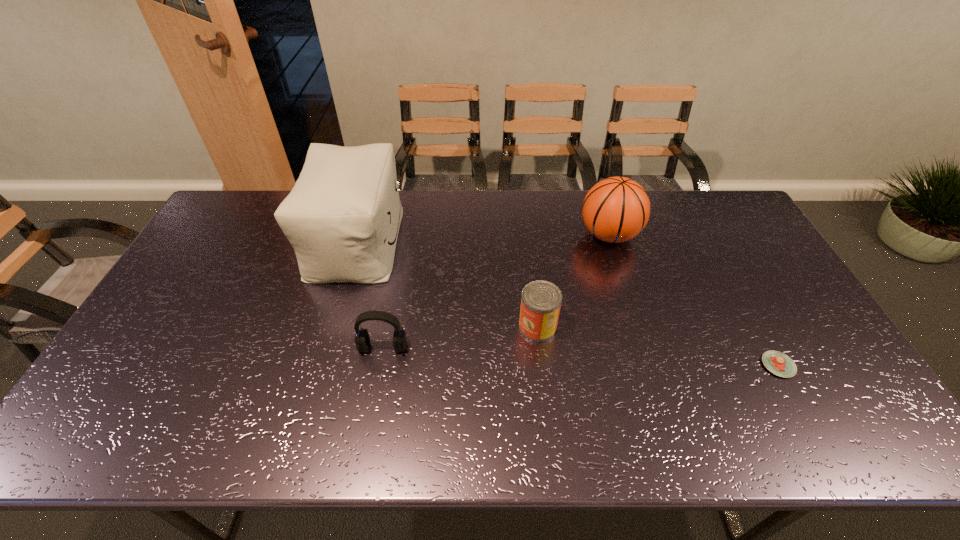
Find the location of `vacant space situated 0.380m on the back of the can`. vacant space situated 0.380m on the back of the can is located at coordinates (526, 227).

The height and width of the screenshot is (540, 960). What are the coordinates of `vacant region located on the back of the pastry` in the screenshot? It's located at (749, 311).

What are the coordinates of `cushion present at the far edge` in the screenshot? It's located at (342, 217).

Locate an element on the screen. The height and width of the screenshot is (540, 960). basketball that is at the far edge is located at coordinates (616, 209).

This screenshot has height=540, width=960. I want to click on object positioned at the right edge, so click(x=778, y=363).

Locate an element on the screen. Image resolution: width=960 pixels, height=540 pixels. free spot at the far edge of the desktop is located at coordinates coord(526,201).

The image size is (960, 540). In order to click on free space at the near edge in this screenshot , I will do `click(592, 424)`.

Find the location of `free space at the left edge of the desktop`. free space at the left edge of the desktop is located at coordinates (166, 376).

You are a GUI agent. You are given a task and a screenshot of the screen. Output one action in this format:
    pyautogui.click(x=<x>, y=<y>)
    Task: Click on the free region at the right edge of the desktop
    
    Given the screenshot: What is the action you would take?
    pyautogui.click(x=816, y=342)

Locate an element on the screen. This screenshot has height=540, width=960. vacant space at the far right corner is located at coordinates (749, 226).